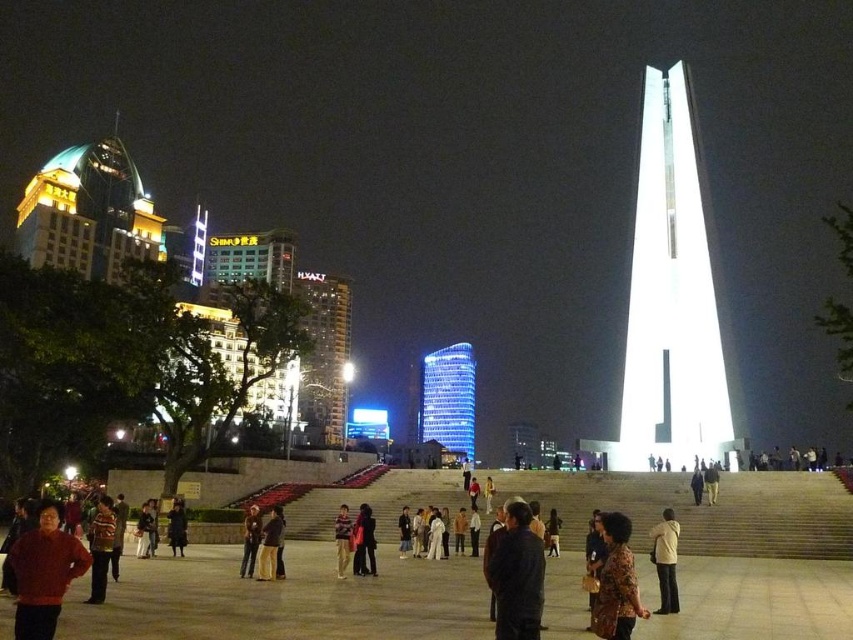
You are standing in the plaza and want to take a photo of the matte gold building at left and the printed fabric jacket at lower center. Which object should you zoom in on to capture both in the frame without cropping?

The printed fabric jacket at lower center is smaller in size compared to the matte gold building at left, so you should zoom in on the printed fabric jacket at lower center to include both in the frame without cropping.

You are an architect designing a new building and want to compare the widths of two elements in the scene. Which object is wider between the blue glass tower at center and the striped sweater at lower left?

The blue glass tower at center is wider than the striped sweater at lower left.